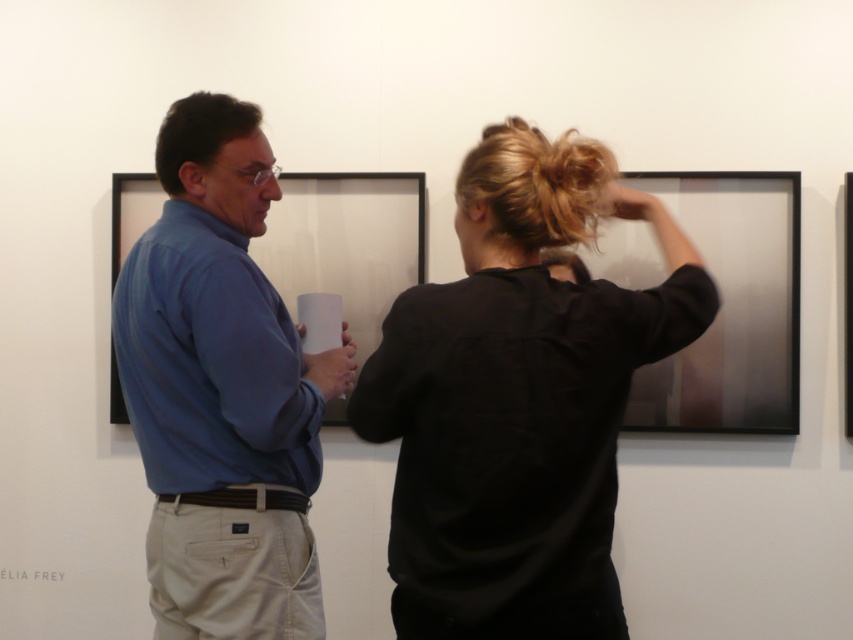
Which of these two, matte blue shirt at left or black matte picture frame at right, stands shorter?

With less height is matte blue shirt at left.

The image size is (853, 640). What are the coordinates of `matte blue shirt at left` in the screenshot? It's located at (210, 362).

Between point (163, 284) and point (846, 177), which one is positioned in front?

Point (163, 284)

The height and width of the screenshot is (640, 853). What are the coordinates of `matte blue shirt at left` in the screenshot? It's located at (210, 362).

Who is shorter, black matte shirt at center or matte black picture frame at upper right?

matte black picture frame at upper right

Is point (668, 340) behind point (647, 365)?

No, (668, 340) is closer to viewer.

Identify the location of black matte shirt at center. The height and width of the screenshot is (640, 853). (519, 397).

Based on the photo, does black matte shirt at center have a larger size compared to black matte picture frame at right?

Yes, black matte shirt at center is bigger than black matte picture frame at right.

The height and width of the screenshot is (640, 853). I want to click on black matte shirt at center, so click(x=519, y=397).

At what (x,y) coordinates should I click in order to perform the action: click on black matte shirt at center. Please return your answer as a coordinate pair (x, y). Looking at the image, I should click on (519, 397).

Where is `black matte shirt at center`? black matte shirt at center is located at coordinates (519, 397).